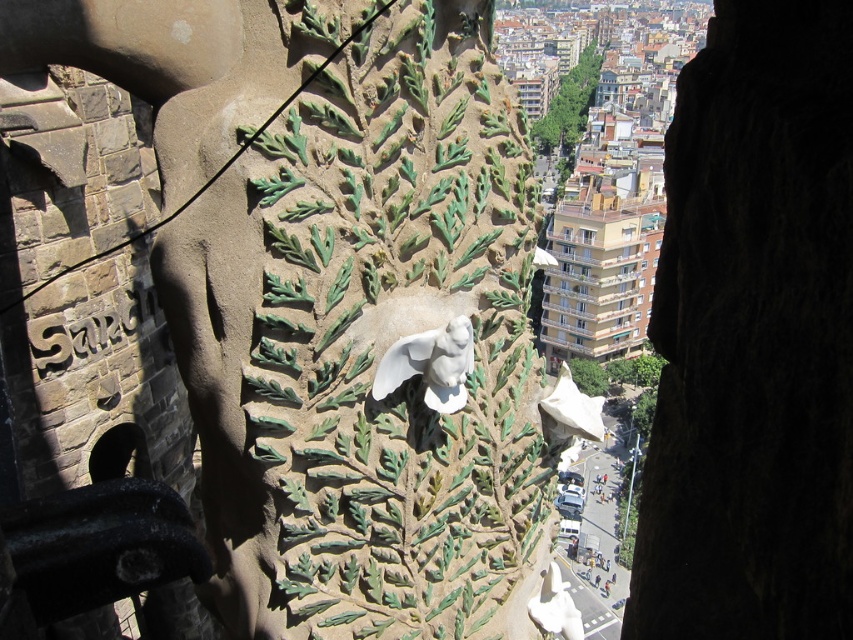
You are an architect analyzing the stone structure. You notice two central elements, the white stone bird at center and the white glossy statue at center. Which one has a greater width?

The white stone bird at center has a greater width than the white glossy statue at center according to the description.

You are an architect designing a new sculpture garden. You have two white statues to place in the center of a circular plaza. The statues are the white stone bird at center and the white glossy statue at center. Given their sizes, which one should you choose to be the focal point of the garden?

The white stone bird at center is larger in size than the white glossy statue at center, so it should be chosen as the focal point of the garden to draw attention effectively.

Based on the coordinates provided in the description, where is the white stone bird at center located on the image?

The white stone bird at center is located at point coordinates of (339, 300).